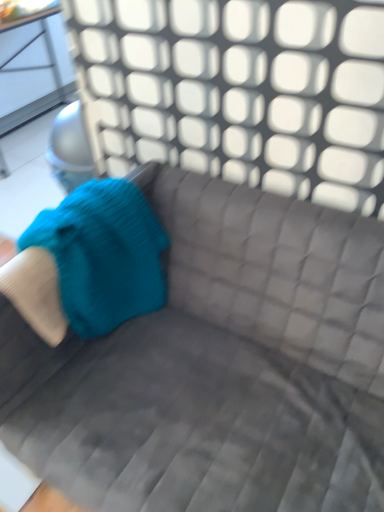
Find the location of `teal knitted bean bag chair at left`. teal knitted bean bag chair at left is located at coordinates (90, 261).

What do you see at coordinates (90, 261) in the screenshot? The height and width of the screenshot is (512, 384). I see `teal knitted bean bag chair at left` at bounding box center [90, 261].

The height and width of the screenshot is (512, 384). Describe the element at coordinates (218, 366) in the screenshot. I see `velvet gray couch at center` at that location.

This screenshot has width=384, height=512. Identify the location of velvet gray couch at center. (218, 366).

In order to click on teal knitted bean bag chair at left in this screenshot , I will do `click(90, 261)`.

Is velvet gray couch at center to the left of teal knitted bean bag chair at left from the viewer's perspective?

No, velvet gray couch at center is not to the left of teal knitted bean bag chair at left.

Considering the positions of objects velvet gray couch at center and teal knitted bean bag chair at left in the image provided, who is in front, velvet gray couch at center or teal knitted bean bag chair at left?

velvet gray couch at center is in front.

Which is nearer, (355, 339) or (117, 197)?

Positioned in front is point (355, 339).

From the image's perspective, which is above, velvet gray couch at center or teal knitted bean bag chair at left?

teal knitted bean bag chair at left appears higher in the image.

From a real-world perspective, is velvet gray couch at center positioned above or below teal knitted bean bag chair at left?

velvet gray couch at center is situated lower than teal knitted bean bag chair at left in the real world.

Is velvet gray couch at center wider than teal knitted bean bag chair at left?

Correct, the width of velvet gray couch at center exceeds that of teal knitted bean bag chair at left.

Between velvet gray couch at center and teal knitted bean bag chair at left, which one has more height?

With more height is velvet gray couch at center.

Who is smaller, velvet gray couch at center or teal knitted bean bag chair at left?

teal knitted bean bag chair at left.

Is teal knitted bean bag chair at left completely or partially inside velvet gray couch at center?

Yes, teal knitted bean bag chair at left is inside velvet gray couch at center.

Are velvet gray couch at center and teal knitted bean bag chair at left far apart?

No.

Is velvet gray couch at center facing away from teal knitted bean bag chair at left?

That's not correct — velvet gray couch at center is not looking away from teal knitted bean bag chair at left.

Measure the distance between velvet gray couch at center and teal knitted bean bag chair at left.

8.36 inches.

You are a GUI agent. You are given a task and a screenshot of the screen. Output one action in this format:
    pyautogui.click(x=<x>, y=<y>)
    Task: Click on the studio couch below the teal knitted bean bag chair at left (from the image's perspective)
    This screenshot has height=512, width=384.
    Given the screenshot: What is the action you would take?
    pyautogui.click(x=218, y=366)

Which is more to the left, teal knitted bean bag chair at left or velvet gray couch at center?

Positioned to the left is teal knitted bean bag chair at left.

Between teal knitted bean bag chair at left and velvet gray couch at center, which one is positioned in front?

velvet gray couch at center is closer to the camera.

Which point is more distant from viewer, [21,301] or [366,249]?

The point [366,249] is more distant.

From the image's perspective, is teal knitted bean bag chair at left beneath velvet gray couch at center?

No, from the image's perspective, teal knitted bean bag chair at left is not below velvet gray couch at center.

Based on the photo, from a real-world perspective, is teal knitted bean bag chair at left physically located above or below velvet gray couch at center?

teal knitted bean bag chair at left is above velvet gray couch at center.

Considering the relative sizes of teal knitted bean bag chair at left and velvet gray couch at center in the image provided, is teal knitted bean bag chair at left wider than velvet gray couch at center?

No.

Who is taller, teal knitted bean bag chair at left or velvet gray couch at center?

velvet gray couch at center.

In the scene shown: Which of these two, teal knitted bean bag chair at left or velvet gray couch at center, is bigger?

Bigger between the two is velvet gray couch at center.

Is teal knitted bean bag chair at left situated inside velvet gray couch at center or outside?

teal knitted bean bag chair at left is contained in velvet gray couch at center.

Is teal knitted bean bag chair at left touching velvet gray couch at center?

teal knitted bean bag chair at left and velvet gray couch at center are clearly separated.

Is teal knitted bean bag chair at left positioned with its back to velvet gray couch at center?

Correct, teal knitted bean bag chair at left is looking away from velvet gray couch at center.

How different are the orientations of teal knitted bean bag chair at left and velvet gray couch at center in degrees?

The facing directions of teal knitted bean bag chair at left and velvet gray couch at center are 90.5 degrees apart.

How distant is teal knitted bean bag chair at left from velvet gray couch at center?

teal knitted bean bag chair at left is 8.36 inches from velvet gray couch at center.

Identify the location of studio couch below the teal knitted bean bag chair at left (from a real-world perspective). This screenshot has width=384, height=512. (218, 366).

This screenshot has height=512, width=384. Identify the location of bean bag chair above the velvet gray couch at center (from a real-world perspective). (90, 261).

Image resolution: width=384 pixels, height=512 pixels. I want to click on bean bag chair behind the velvet gray couch at center, so click(x=90, y=261).